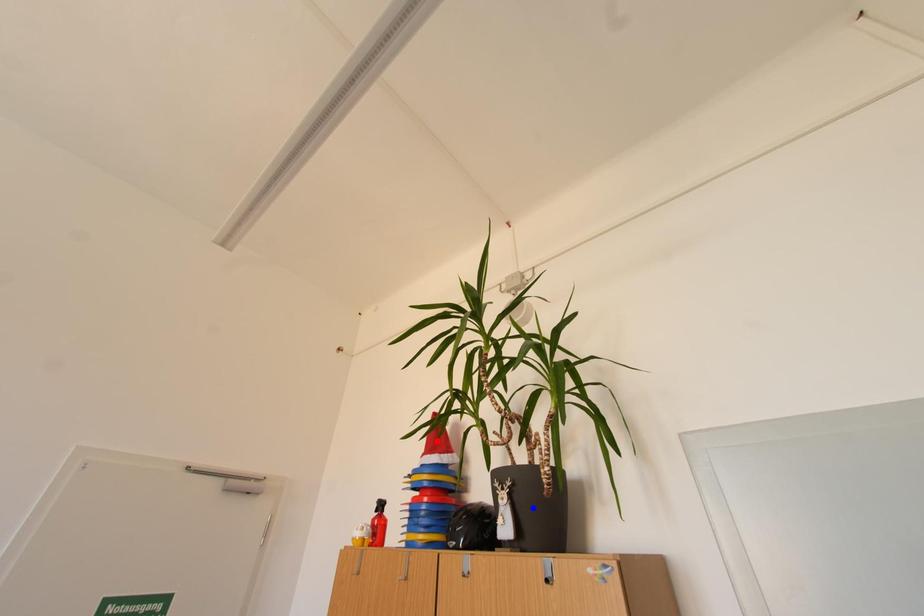
Question: In the image, two points are highlighted. Which point is nearer to the camera? Reply with the corresponding letter.

Choices:
 (A) blue point
 (B) red point

Answer: (A)